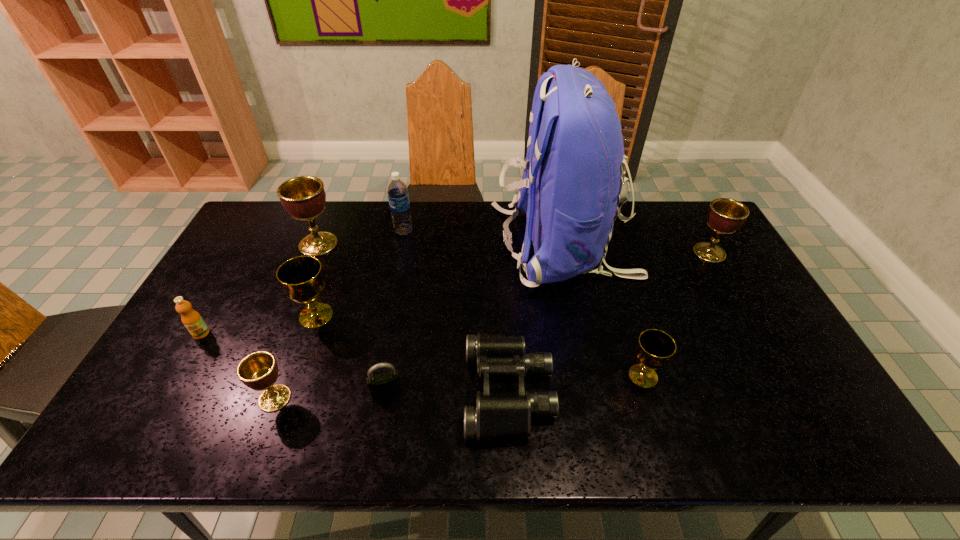
Locate an element on the screen. The width and height of the screenshot is (960, 540). free space that is in between the biggest golden chalice and the water bottle is located at coordinates (361, 238).

Where is `vacant area that lies between the black padlock and the bigger gold chalice`? The width and height of the screenshot is (960, 540). vacant area that lies between the black padlock and the bigger gold chalice is located at coordinates 351,354.

Where is `free spot between the leftmost object and the second biggest golden chalice`? Image resolution: width=960 pixels, height=540 pixels. free spot between the leftmost object and the second biggest golden chalice is located at coordinates (455, 293).

I want to click on vacant area that lies between the smallest golden chalice and the water bottle, so click(339, 315).

What are the coordinates of `vacant space that is in between the padlock and the biggest golden chalice` in the screenshot? It's located at (352, 318).

Locate an element on the screen. free space between the smaller gold chalice and the second smallest golden chalice is located at coordinates (676, 314).

In order to click on free space that is in between the left gold chalice and the backpack in this screenshot , I will do `click(440, 280)`.

The image size is (960, 540). I want to click on vacant space in between the orange juice and the tallest chalice, so click(x=260, y=289).

At what (x,y) coordinates should I click in order to perform the action: click on free space between the water bottle and the nearer gold chalice. Please return your answer as a coordinate pair (x, y). Image resolution: width=960 pixels, height=540 pixels. Looking at the image, I should click on (523, 303).

Identify which object is the second closest to the right gold chalice. Please provide its 2D coordinates. Your answer should be formatted as a tuple, i.e. [(x, y)], where the tuple contains the x and y coordinates of a point satisfying the conditions above.

[(573, 181)]